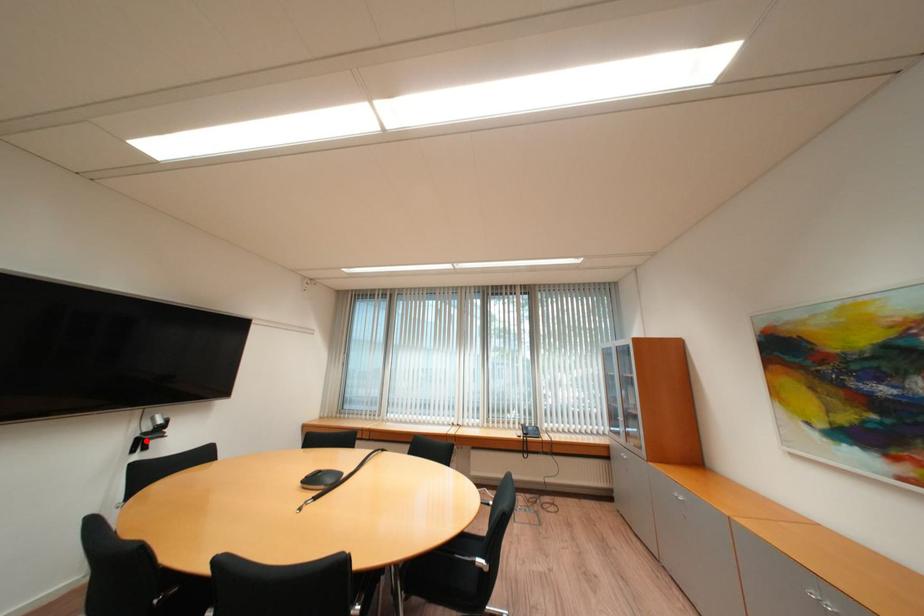
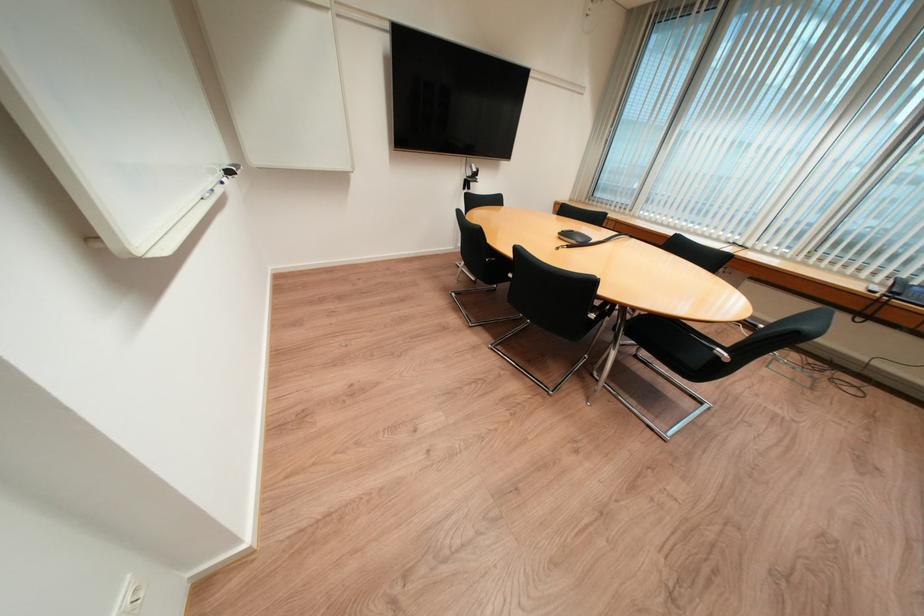
Question: A red point is marked in image1. In image2, is the corresponding 3D point closer to the camera or farther? Reply with the corresponding letter.

Choices:
 (A) The corresponding 3D point is closer.
 (B) The corresponding 3D point is farther.

Answer: (A)